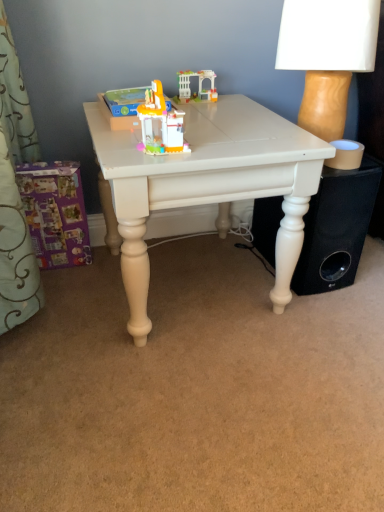
Where is `vacant area located to the right-hand side of purple cardboard box at lower left, acting as the 2th toy starting from the back`? This screenshot has width=384, height=512. vacant area located to the right-hand side of purple cardboard box at lower left, acting as the 2th toy starting from the back is located at coordinates (102, 270).